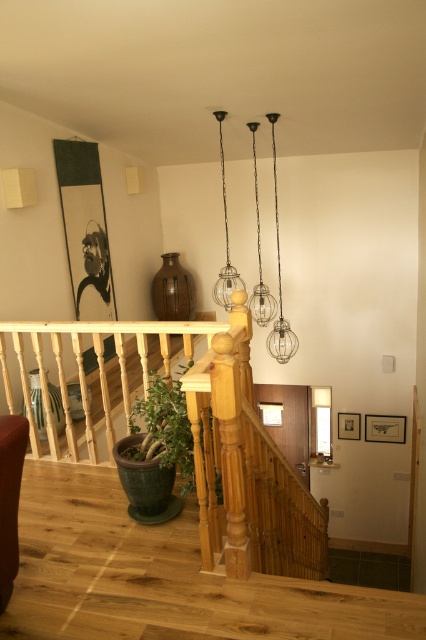
Question: Can you confirm if natural wood stair rail at center is smaller than green matte plant at lower left?

Choices:
 (A) no
 (B) yes

Answer: (A)

Question: Which of the following is the farthest from the observer?

Choices:
 (A) (60, 401)
 (B) (155, 371)

Answer: (A)

Question: Does natural wood stair rail at center come in front of green matte plant at lower left?

Choices:
 (A) yes
 (B) no

Answer: (A)

Question: Can you confirm if natural wood stair rail at center is smaller than green matte plant at lower left?

Choices:
 (A) yes
 (B) no

Answer: (B)

Question: Which of the following is the farthest from the observer?

Choices:
 (A) green matte plant at lower left
 (B) natural wood stair rail at center

Answer: (A)